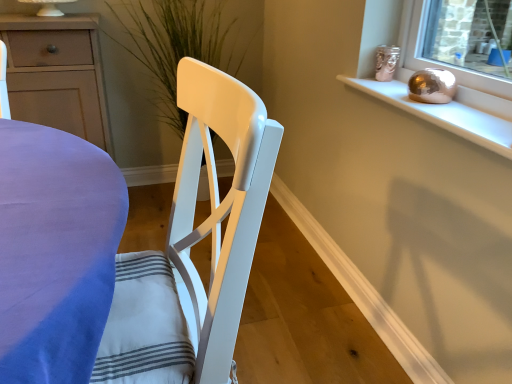
Question: Considering the relative sizes of metallic gold sphere at upper right and matte white cabinet at left in the image provided, is metallic gold sphere at upper right bigger than matte white cabinet at left?

Choices:
 (A) yes
 (B) no

Answer: (B)

Question: Is metallic gold sphere at upper right positioned with its back to matte white cabinet at left?

Choices:
 (A) no
 (B) yes

Answer: (A)

Question: From the image's perspective, would you say metallic gold sphere at upper right is positioned over matte white cabinet at left?

Choices:
 (A) no
 (B) yes

Answer: (A)

Question: Does metallic gold sphere at upper right touch matte white cabinet at left?

Choices:
 (A) yes
 (B) no

Answer: (B)

Question: Is metallic gold sphere at upper right not inside matte white cabinet at left?

Choices:
 (A) yes
 (B) no

Answer: (A)

Question: Based on their sizes in the image, would you say green matte plant at center is bigger or smaller than white glossy chair at center?

Choices:
 (A) big
 (B) small

Answer: (A)

Question: From a real-world perspective, is green matte plant at center physically located above or below white glossy chair at center?

Choices:
 (A) above
 (B) below

Answer: (A)

Question: Is green matte plant at center wider or thinner than white glossy chair at center?

Choices:
 (A) thin
 (B) wide

Answer: (B)

Question: Would you say green matte plant at center is to the left or to the right of white glossy chair at center in the picture?

Choices:
 (A) left
 (B) right

Answer: (A)

Question: Would you say metallic gold sphere at upper right is inside or outside matte white cabinet at left?

Choices:
 (A) inside
 (B) outside

Answer: (B)

Question: Is point (489, 97) closer or farther from the camera than point (31, 115)?

Choices:
 (A) closer
 (B) farther

Answer: (A)

Question: Considering their positions, is metallic gold sphere at upper right located in front of or behind matte white cabinet at left?

Choices:
 (A) front
 (B) behind

Answer: (A)

Question: Is metallic gold sphere at upper right bigger or smaller than matte white cabinet at left?

Choices:
 (A) big
 (B) small

Answer: (B)

Question: Looking at their shapes, would you say green matte plant at center is wider or thinner than matte white cabinet at left?

Choices:
 (A) thin
 (B) wide

Answer: (B)

Question: From a real-world perspective, is green matte plant at center physically located above or below matte white cabinet at left?

Choices:
 (A) below
 (B) above

Answer: (B)